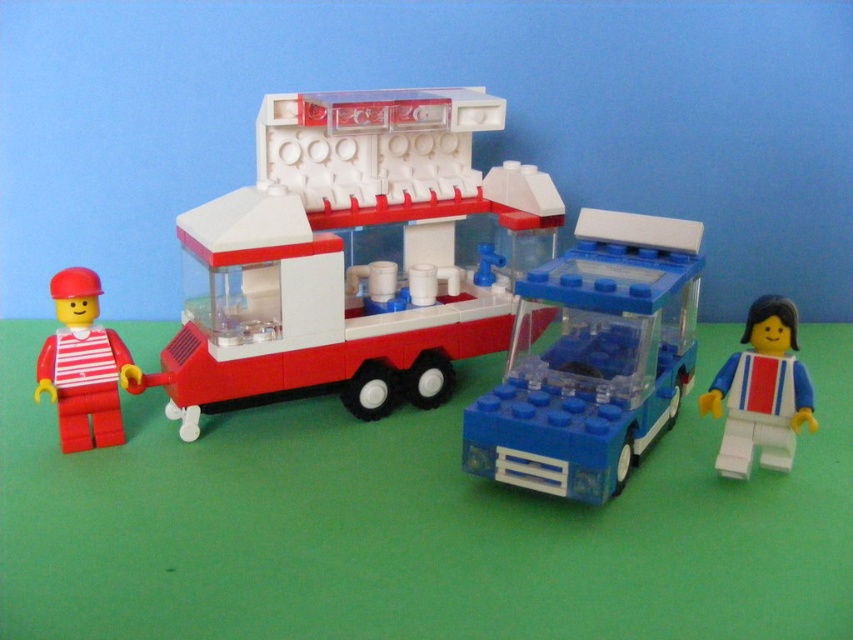
Question: Is transparent plastic bus at center thinner than white plastic figure at right?

Choices:
 (A) no
 (B) yes

Answer: (A)

Question: Does matte plastic food truck at center appear over matte red minifigure at left?

Choices:
 (A) yes
 (B) no

Answer: (A)

Question: Which object is positioned closest to the matte plastic food truck at center?

Choices:
 (A) transparent plastic bus at center
 (B) matte red minifigure at left
 (C) white plastic figure at right

Answer: (A)

Question: Which of the following is the farthest from the observer?

Choices:
 (A) (723, 465)
 (B) (494, 433)
 (C) (476, 234)
 (D) (67, 390)

Answer: (C)

Question: Which point is closer to the camera?

Choices:
 (A) (577, 474)
 (B) (61, 417)
 (C) (769, 456)
 (D) (367, 275)

Answer: (A)

Question: Does matte plastic food truck at center appear on the left side of transparent plastic bus at center?

Choices:
 (A) yes
 (B) no

Answer: (A)